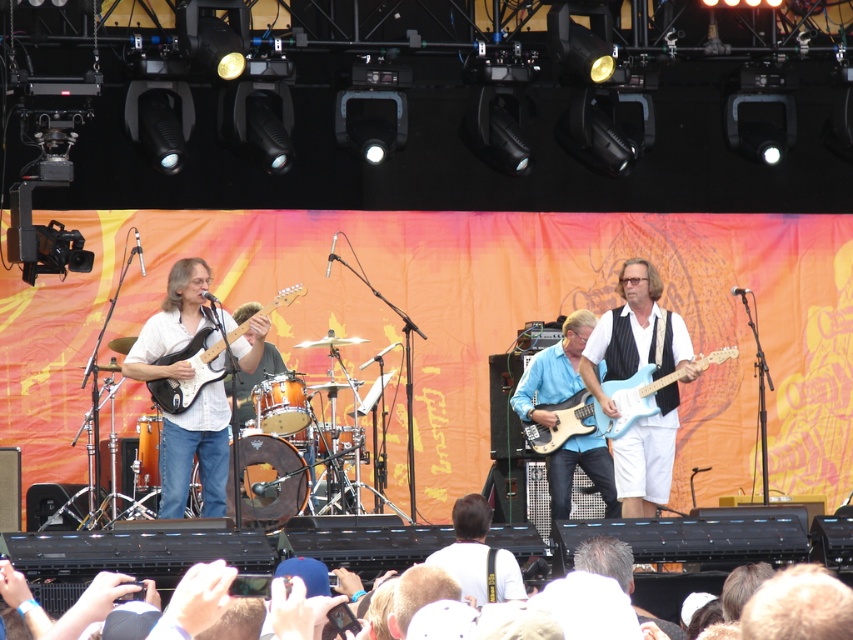
Can you confirm if matte white guitar at left is positioned below white fabric shirt at center?

No, matte white guitar at left is not below white fabric shirt at center.

In the scene shown: Can you confirm if matte white guitar at left is bigger than white fabric shirt at center?

Yes.

Is point (200, 428) closer to camera compared to point (467, 531)?

No, (200, 428) is further to viewer.

The image size is (853, 640). What are the coordinates of `matte white guitar at left` in the screenshot? It's located at (195, 452).

Who is lower down, blue glossy guitar at center or matte white guitar at center?

matte white guitar at center is below.

Which is behind, point (527, 397) or point (241, 310)?

The point (241, 310) is behind.

Find the location of a particular element. The width and height of the screenshot is (853, 640). blue glossy guitar at center is located at coordinates (553, 371).

At what (x,y) coordinates should I click in order to perform the action: click on blue glossy guitar at center. Please return your answer as a coordinate pair (x, y). Image resolution: width=853 pixels, height=640 pixels. Looking at the image, I should click on (553, 371).

Is the position of blue glossy guitar at center less distant than that of blue glossy electric guitar at center?

No, blue glossy guitar at center is behind blue glossy electric guitar at center.

Is point (567, 513) closer to viewer compared to point (651, 413)?

That is False.

Image resolution: width=853 pixels, height=640 pixels. Describe the element at coordinates (553, 371) in the screenshot. I see `blue glossy guitar at center` at that location.

You are a GUI agent. You are given a task and a screenshot of the screen. Output one action in this format:
    pyautogui.click(x=<x>, y=<y>)
    Task: Click on the blue glossy guitar at center
    Image resolution: width=853 pixels, height=640 pixels.
    Given the screenshot: What is the action you would take?
    pyautogui.click(x=553, y=371)